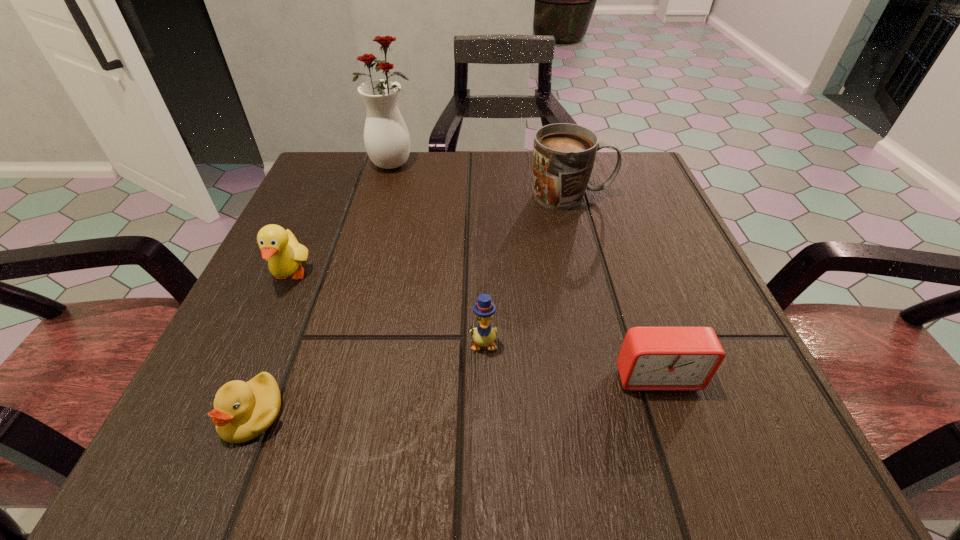
Identify which object is the closest to the farthest duckling. Please provide its 2D coordinates. Your answer should be formatted as a tuple, i.e. [(x, y)], where the tuple contains the x and y coordinates of a point satisfying the conditions above.

[(242, 411)]

Image resolution: width=960 pixels, height=540 pixels. In order to click on object that is the fourth nearest to the nearest duckling in this screenshot , I will do `click(564, 154)`.

Choose which duckling is the nearest neighbor to the rightmost duckling. Please provide its 2D coordinates. Your answer should be formatted as a tuple, i.e. [(x, y)], where the tuple contains the x and y coordinates of a point satisfying the conditions above.

[(242, 411)]

Where is `duckling that is the closest to the mug`? duckling that is the closest to the mug is located at coordinates (484, 335).

The image size is (960, 540). In order to click on free location that satisfies the following two spatial constraints: 1. on the side of the fifth shortest object with the handle; 2. on the front-facing side of the farthest duckling in this screenshot , I will do `click(592, 276)`.

Identify the location of vacant region that satisfies the following two spatial constraints: 1. on the side of the fifth nearest object with the handle; 2. on the front-facing side of the nearest duckling. The image size is (960, 540). (628, 413).

Locate an element on the screen. The height and width of the screenshot is (540, 960). free space in the image that satisfies the following two spatial constraints: 1. on the side of the second tallest object with the handle; 2. on the front-facing side of the farthest duckling is located at coordinates click(x=592, y=276).